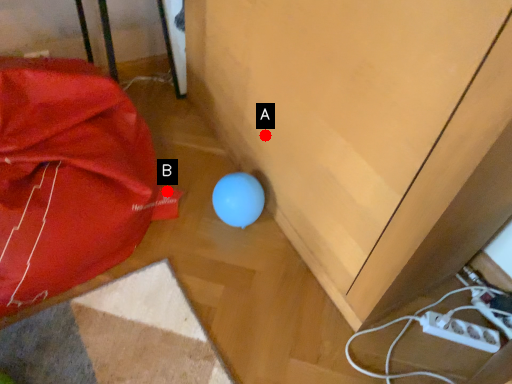
Question: Two points are circled on the image, labeled by A and B beside each circle. Which point appears closest to the camera in this image?

Choices:
 (A) A is closer
 (B) B is closer

Answer: (A)